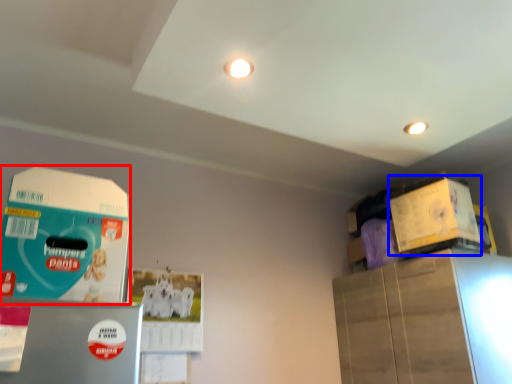
Question: Which object appears farthest to the camera in this image, box (highlighted by a red box) or box (highlighted by a blue box)?

Choices:
 (A) box
 (B) box

Answer: (B)